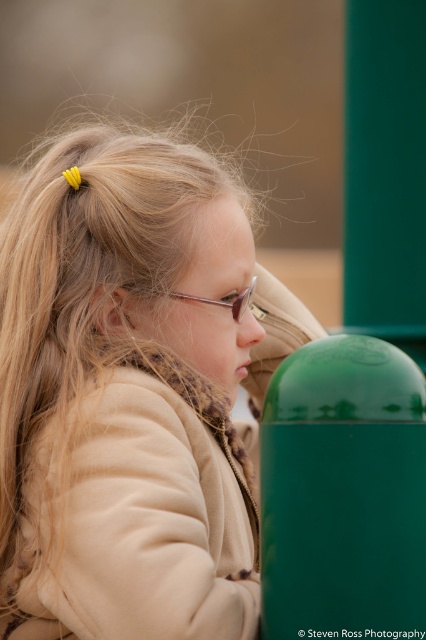
You are an artist trying to sketch the girl in the scene. To ensure accuracy, you need to know the location of the matte beige coat at center. Can you tell me its coordinates?

The matte beige coat at center is located at coordinates point (132, 394).